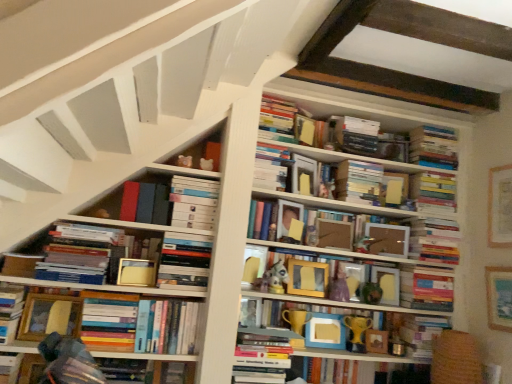
The image size is (512, 384). Find the location of `hardcover books at left, the fifth book viewed from the top`. hardcover books at left, the fifth book viewed from the top is located at coordinates (193, 203).

Measure the distance between point (356,186) and camera.

The depth of point (356,186) is 2.18 meters.

In order to face matte gold trophy at center, which appears as the 5th book when ordered from the bottom, should I rotate leftwards or rightwards?

It's best to rotate right around 9.810 degrees.

Image resolution: width=512 pixels, height=384 pixels. What do you see at coordinates (420, 340) in the screenshot?
I see `matte gold trophy at center, which appears as the 12th book when viewed from the top` at bounding box center [420, 340].

What is the approximate width of wooden picture frame at center, positioned as the fourth picture frame in right-to-left order?

wooden picture frame at center, positioned as the fourth picture frame in right-to-left order, is 2.31 inches in width.

At what (x,y) coordinates should I click in order to perform the action: click on hardcover book at upper center, which ranks as the third paperback book in left-to-right order. Please return your answer as a coordinate pair (x, y). Image resolution: width=512 pixels, height=384 pixels. Looking at the image, I should click on (304, 175).

How much space does gold-framed picture at upper right, arranged as the 5th picture frame when viewed from the left, occupy vertically?

The height of gold-framed picture at upper right, arranged as the 5th picture frame when viewed from the left, is 16.08 inches.

You are a GUI agent. You are given a task and a screenshot of the screen. Output one action in this format:
    pyautogui.click(x=<x>, y=<y>)
    Task: Click on the hardcover book at upper center, the 1th book from the top
    This screenshot has width=512, height=384.
    Given the screenshot: What is the action you would take?
    pyautogui.click(x=277, y=119)

What do you see at coordinates (277, 119) in the screenshot?
I see `hardcover book at upper center, the 1th book from the top` at bounding box center [277, 119].

Image resolution: width=512 pixels, height=384 pixels. I want to click on gold plastic trophy at center, positioned as the first toy in bottom-to-top order, so click(356, 332).

Is hardcover book at upper center, which ranks as the 16th book in bottom-to-top order, positioned beyond the bounds of hardcover book at upper right, placed as the tenth book when sorted from top to bottom?

Yes.

Based on their sizes in the image, would you say hardcover book at upper center, which ranks as the 16th book in bottom-to-top order, is bigger or smaller than hardcover book at upper right, placed as the seventh book when sorted from bottom to top?

Considering their sizes, hardcover book at upper center, which ranks as the 16th book in bottom-to-top order, takes up less space than hardcover book at upper right, placed as the seventh book when sorted from bottom to top.

From a real-world perspective, is hardcover book at upper center, the 1th book from the top, physically above hardcover book at upper right, placed as the seventh book when sorted from bottom to top?

Yes.

In the scene shown: From the image's perspective, which is above, hardcover book at upper center, the 1th book from the top, or hardcover book at upper right, placed as the seventh book when sorted from bottom to top?

From the image's view, hardcover book at upper center, the 1th book from the top, is above.

From a real-world perspective, which paperback book is the 1st one above the hardcover book at center, the thirteenth book in the top-to-bottom sequence? Please provide its 2D coordinates.

[(136, 272)]

Considering the points (277, 333) and (122, 270), which point is in front, point (277, 333) or point (122, 270)?

Point (122, 270)

From the picture: From the image's perspective, is hardcover book at center, the fourth book in the bottom-to-top sequence, above matte gold frame at center, which is the fifth paperback book from right to left?

No, from the image's perspective, hardcover book at center, the fourth book in the bottom-to-top sequence, is not on top of matte gold frame at center, which is the fifth paperback book from right to left.

Can you tell me how much gold-framed picture at upper right, arranged as the 5th picture frame when viewed from the left, and hardcover books at upper right, the fourth book from the top, differ in facing direction?

90.3 degrees.

Which is more to the left, gold-framed picture at upper right, which ranks as the 1th picture frame in right-to-left order, or hardcover books at upper right, acting as the thirteenth book starting from the bottom?

hardcover books at upper right, acting as the thirteenth book starting from the bottom.

Is gold-framed picture at upper right, which ranks as the 1th picture frame in right-to-left order, further to the viewer compared to hardcover books at upper right, acting as the thirteenth book starting from the bottom?

No, gold-framed picture at upper right, which ranks as the 1th picture frame in right-to-left order, is closer to the camera.

Is the surface of gold-framed picture at upper right, arranged as the 5th picture frame when viewed from the left, in direct contact with hardcover books at upper right, the fourth book from the top?

gold-framed picture at upper right, arranged as the 5th picture frame when viewed from the left, is not next to hardcover books at upper right, the fourth book from the top, and they're not touching.

Is hardcover book at center, the second paperback book in the front-to-back sequence, further to camera compared to gold-framed picture at upper right, which ranks as the 1th picture frame in right-to-left order?

Yes, the depth of hardcover book at center, the second paperback book in the front-to-back sequence, is greater than that of gold-framed picture at upper right, which ranks as the 1th picture frame in right-to-left order.

Which object is thinner, hardcover book at center, the second paperback book in the left-to-right sequence, or gold-framed picture at upper right, arranged as the 5th picture frame when viewed from the left?

Thinner between the two is gold-framed picture at upper right, arranged as the 5th picture frame when viewed from the left.

Which picture frame is the 4th one when counting from the right side of the hardcover book at center, which ranks as the 4th paperback book in right-to-left order? Please provide its 2D coordinates.

[(500, 207)]

Is hardcover book at center, the second paperback book in the left-to-right sequence, oriented towards gold-framed picture at upper right, which ranks as the 1th picture frame in right-to-left order?

No, hardcover book at center, the second paperback book in the left-to-right sequence, is not turned towards gold-framed picture at upper right, which ranks as the 1th picture frame in right-to-left order.

In terms of width, does hardcover books at upper right, arranged as the 2th book when viewed from the top, look wider or thinner when compared to hardcover book at center, which ranks as the 4th paperback book in right-to-left order?

hardcover books at upper right, arranged as the 2th book when viewed from the top, is wider than hardcover book at center, which ranks as the 4th paperback book in right-to-left order.

How different are the orientations of hardcover books at upper right, the fifteenth book ordered from the bottom, and hardcover book at center, the second paperback book in the front-to-back sequence, in degrees?

25.2 degrees.

Between hardcover books at upper right, the fifteenth book ordered from the bottom, and hardcover book at center, the second paperback book in the front-to-back sequence, which one is positioned behind?

Positioned behind is hardcover books at upper right, the fifteenth book ordered from the bottom.

Is hardcover books at upper right, the fifteenth book ordered from the bottom, not within hardcover book at center, the second paperback book in the left-to-right sequence?

Yes.

From a real-world perspective, is hardcover book at upper center, arranged as the second paperback book when viewed from the back, physically below gold plastic trophy at center, which ranks as the 2th toy in left-to-right order?

No, from a real-world perspective, hardcover book at upper center, arranged as the second paperback book when viewed from the back, is not below gold plastic trophy at center, which ranks as the 2th toy in left-to-right order.

From the image's perspective, is hardcover book at upper center, the fifth paperback book in the left-to-right sequence, below gold plastic trophy at center, the first toy viewed from the right?

No, from the image's perspective, hardcover book at upper center, the fifth paperback book in the left-to-right sequence, is not below gold plastic trophy at center, the first toy viewed from the right.

Looking at their sizes, would you say hardcover book at upper center, arranged as the second paperback book when viewed from the back, is wider or thinner than gold plastic trophy at center, the first toy viewed from the right?

In the image, hardcover book at upper center, arranged as the second paperback book when viewed from the back, appears to be wider than gold plastic trophy at center, the first toy viewed from the right.

Which is correct: hardcover book at upper center, the first paperback book viewed from the right, is inside gold plastic trophy at center, placed as the second toy when sorted from top to bottom, or outside of it?

hardcover book at upper center, the first paperback book viewed from the right, lies outside gold plastic trophy at center, placed as the second toy when sorted from top to bottom.

Is hardcover books at upper right, the fourth book from the top, touching hardcover book at center, which ranks as the 4th paperback book in right-to-left order?

No, hardcover books at upper right, the fourth book from the top, is not in contact with hardcover book at center, which ranks as the 4th paperback book in right-to-left order.

Between hardcover books at upper right, the fourth book from the top, and hardcover book at center, the second paperback book in the front-to-back sequence, which one has larger size?

hardcover books at upper right, the fourth book from the top, is bigger.

Is hardcover books at upper right, the fourth book from the top, facing towards hardcover book at center, the second paperback book in the front-to-back sequence?

No, hardcover books at upper right, the fourth book from the top, is not facing towards hardcover book at center, the second paperback book in the front-to-back sequence.

Which point is more distant from viewer, (434, 184) or (280, 219)?

Point (434, 184)

Find the location of a particular element. the 9th book below the hardcover book at upper center, the 1th book from the top (from the image's perspective) is located at coordinates (426, 288).

I want to click on book that is the 4th one below the matte gold frame at center, arranged as the 5th paperback book when viewed from the back (from a real-world perspective), so coord(264,357).

Based on their spatial positions, is hardcover books at upper right, the fifteenth book ordered from the bottom, or hardcover book at upper center, which ranks as the third paperback book in front-to-back order, closer to matte cardboard photo frame at center, the second paperback book from the right?

hardcover book at upper center, which ranks as the third paperback book in front-to-back order.

When comparing their distances from hardcover books at left, positioned as the twelfth book in bottom-to-top order, does matte gold trophy at center, which appears as the 5th book when ordered from the bottom, or hardcover books at left, the seventh book from the top, seem closer?

The object closer to hardcover books at left, positioned as the twelfth book in bottom-to-top order, is hardcover books at left, the seventh book from the top.

Which object lies further to the anchor point hardcover books at upper right, the fifteenth book ordered from the bottom, wooden picture frame at center, which appears as the 3th picture frame when viewed from the right, or matte gold trophy at center, which appears as the 5th book when ordered from the bottom?

wooden picture frame at center, which appears as the 3th picture frame when viewed from the right.

When comparing their distances from wooden picture frame at right, the fourth picture frame from the left, does hardcover books at center, positioned as the eighth book in top-to-bottom order, or wooden frame at center, arranged as the ninth book when viewed from the top, seem further?

hardcover books at center, positioned as the eighth book in top-to-bottom order, is further to wooden picture frame at right, the fourth picture frame from the left.

Estimate the real-world distances between objects in this image. Which object is further from matte gold trophy at lower right, the fourteenth book in the top-to-bottom sequence, hardcover book at upper center, which ranks as the 16th book in bottom-to-top order, or hardcover book at upper right, placed as the seventh book when sorted from bottom to top?

hardcover book at upper center, which ranks as the 16th book in bottom-to-top order, is positioned further to the anchor matte gold trophy at lower right, the fourteenth book in the top-to-bottom sequence.

When comparing their distances from wooden picture frame at right, the fourth picture frame from the left, does wooden picture frame at lower left, the first picture frame from the left, or hardcover book at upper center, arranged as the second paperback book when viewed from the back, seem further?

Based on the image, wooden picture frame at lower left, the first picture frame from the left, appears to be further to wooden picture frame at right, the fourth picture frame from the left.

Considering their positions, is hardcover books at upper right, acting as the thirteenth book starting from the bottom, positioned further to hardcover books at left, the fifth book viewed from the top, than hardcover books at left, the seventh book from the top?

Based on the image, hardcover books at upper right, acting as the thirteenth book starting from the bottom, appears to be further to hardcover books at left, the fifth book viewed from the top.

From the image, which object appears to be nearer to hardcover book at upper right, placed as the seventh book when sorted from bottom to top, matte gold trophy at center, which appears as the 5th book when ordered from the bottom, or hardcover book at center, the fourth book in the bottom-to-top sequence?

matte gold trophy at center, which appears as the 5th book when ordered from the bottom, lies closer to hardcover book at upper right, placed as the seventh book when sorted from bottom to top, than the other object.

Find the location of a particular element. bookcase between hardcover book at upper center, the third paperback book when ordered from back to front, and hardcover book at lower center, which ranks as the sixteenth book in top-to-bottom order, in the vertical direction is located at coordinates (231, 228).

This screenshot has height=384, width=512. I want to click on picture frame situated between wooden picture frame at center, positioned as the fourth picture frame in right-to-left order, and wooden picture frame at right, which appears as the 2th picture frame when viewed from the right, from left to right, so click(x=376, y=341).

The height and width of the screenshot is (384, 512). Identify the location of picture frame between hardcover books at lower left, which is the 6th book in bottom-to-top order, and matte gold trophy at center, which appears as the 12th book when viewed from the top, in the horizontal direction. (307, 278).

The width and height of the screenshot is (512, 384). Identify the location of bookcase between hardcover book at lower left, positioned as the 2th book in bottom-to-top order, and wooden picture frame at right, which appears as the 2th picture frame when viewed from the right, in the horizontal direction. (231, 228).